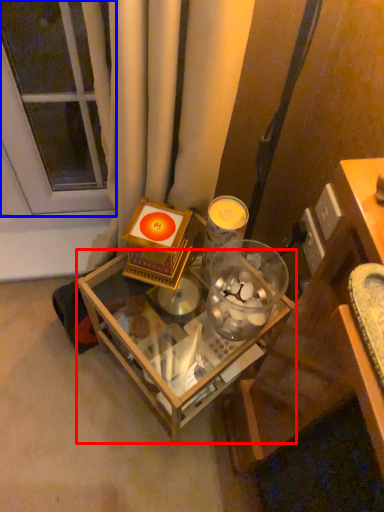
Question: Among these objects, which one is farthest to the camera, table (highlighted by a red box) or glass door (highlighted by a blue box)?

Choices:
 (A) table
 (B) glass door

Answer: (B)